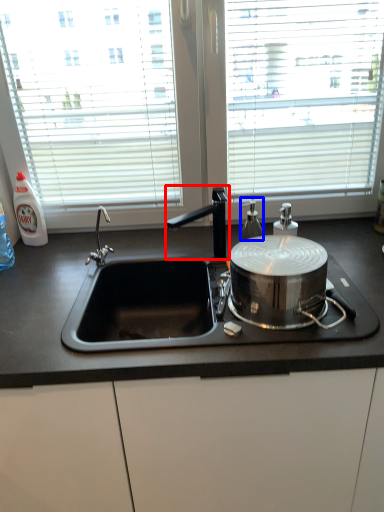
Question: Which object is further to the camera taking this photo, tap (highlighted by a red box) or bottle (highlighted by a blue box)?

Choices:
 (A) tap
 (B) bottle

Answer: (B)